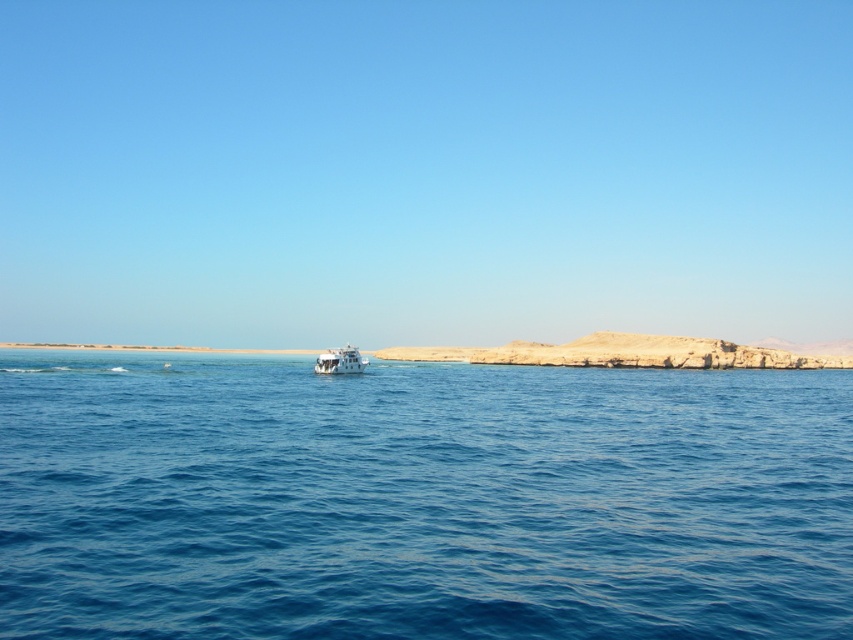
You are a sailor navigating a boat and see the white rocky coast at center and the white glossy boat at center. Which object is positioned to the right?

The white rocky coast at center is to the right of the white glossy boat at center, so the white rocky coast at center is positioned to the right.